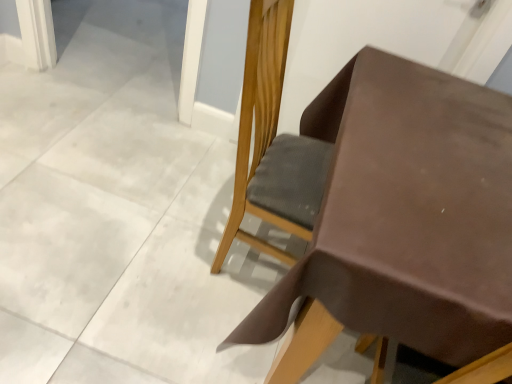
Describe the element at coordinates (261, 113) in the screenshot. Image resolution: width=512 pixels, height=384 pixels. I see `brown fabric chair at center` at that location.

The height and width of the screenshot is (384, 512). Find the location of `brown fabric chair at center`. brown fabric chair at center is located at coordinates (261, 113).

Find the location of a particular element. The image size is (512, 384). brown fabric chair at center is located at coordinates (261, 113).